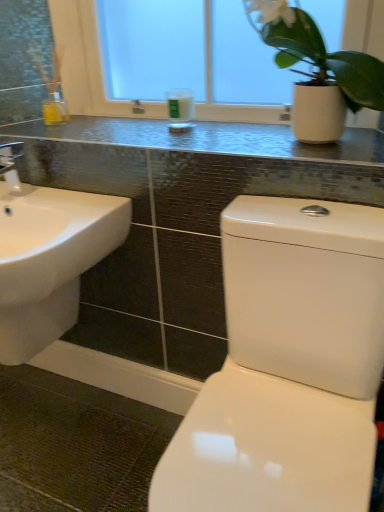
Question: Is white frosted glass at upper center wider or thinner than white glass candle at center?

Choices:
 (A) thin
 (B) wide

Answer: (B)

Question: From a real-world perspective, is white frosted glass at upper center physically located above or below white glass candle at center?

Choices:
 (A) below
 (B) above

Answer: (B)

Question: Estimate the real-world distances between objects in this image. Which object is closer to the white glossy sink at lower left?

Choices:
 (A) white glass candle at center
 (B) metallic mosaic tile counter top at upper center
 (C) white frosted glass at upper center
 (D) white matte pot at upper right
 (E) white glossy toilet at lower right

Answer: (B)

Question: Based on their relative distances, which object is nearer to the white frosted glass at upper center?

Choices:
 (A) white matte pot at upper right
 (B) white glossy toilet at lower right
 (C) white glossy sink at lower left
 (D) white glass candle at center
 (E) metallic mosaic tile counter top at upper center

Answer: (D)